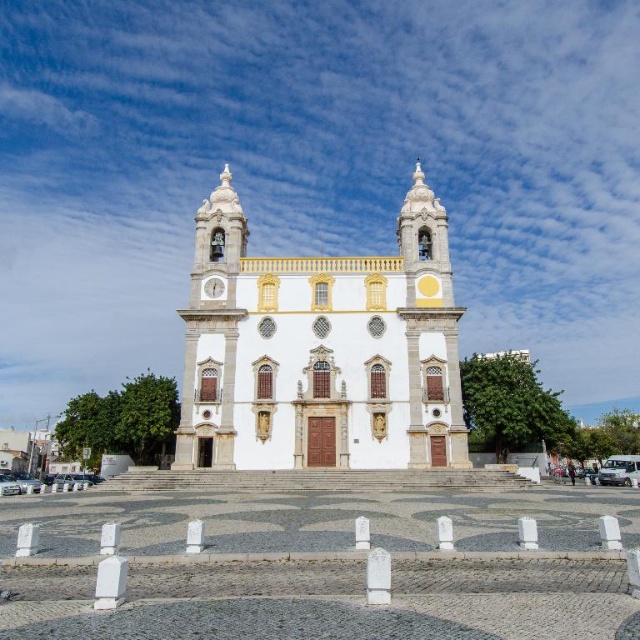
You are standing in front of the grand church and want to take a photo. There are two points marked on the church facade at coordinates point (400, 448) and point (218, 294). Which of these points is closer to your camera position?

Point (400, 448) is closer to the camera than point (218, 294).

You are standing in front of the church and want to take a photo that includes both the white glossy church at center and the white glossy clock at center. Since you want both to be clearly visible, which object should you focus on to ensure it appears larger in the photo?

The white glossy church at center is bigger than the white glossy clock at center, so you should focus on the white glossy church at center to ensure it appears larger in the photo.

You are standing in front of the church and want to know the time. You see the white glossy clock at center and the white glossy church at center. Where is the clock located in relation to the church?

The white glossy clock at center is below the white glossy church at center because the church is above the clock.